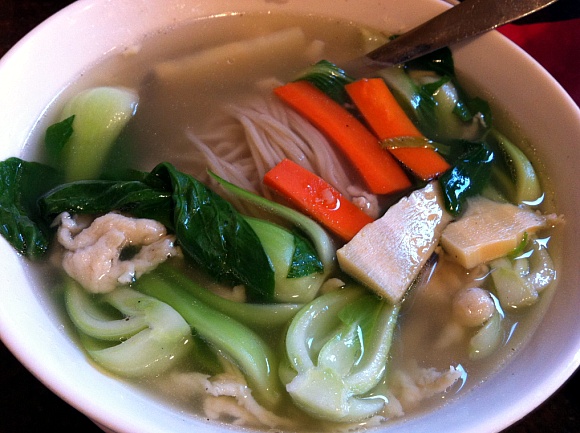
Locate an element on the screen. white coloring of bowl is located at coordinates (541, 380).